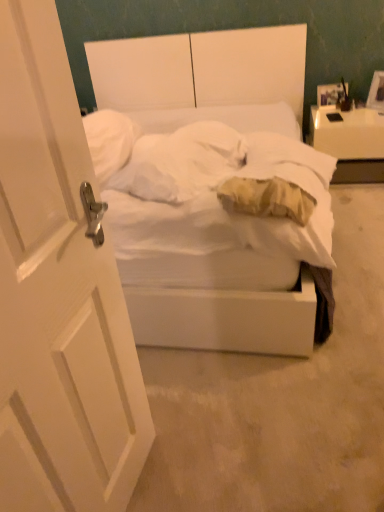
Question: From the image's perspective, is soft yellow pillow at center above or below white matte bed at center?

Choices:
 (A) below
 (B) above

Answer: (A)

Question: In the image, is soft yellow pillow at center on the left side or the right side of white matte bed at center?

Choices:
 (A) right
 (B) left

Answer: (A)

Question: Estimate the real-world distances between objects in this image. Which object is closer to the soft yellow pillow at center?

Choices:
 (A) white matte bed at center
 (B) white glossy nightstand at upper right
 (C) wooden photo frame at upper right
 (D) white matte door at left

Answer: (D)

Question: Which object is positioned closest to the white glossy nightstand at upper right?

Choices:
 (A) white matte bed at center
 (B) wooden photo frame at upper right
 (C) soft yellow pillow at center
 (D) white matte door at left

Answer: (B)